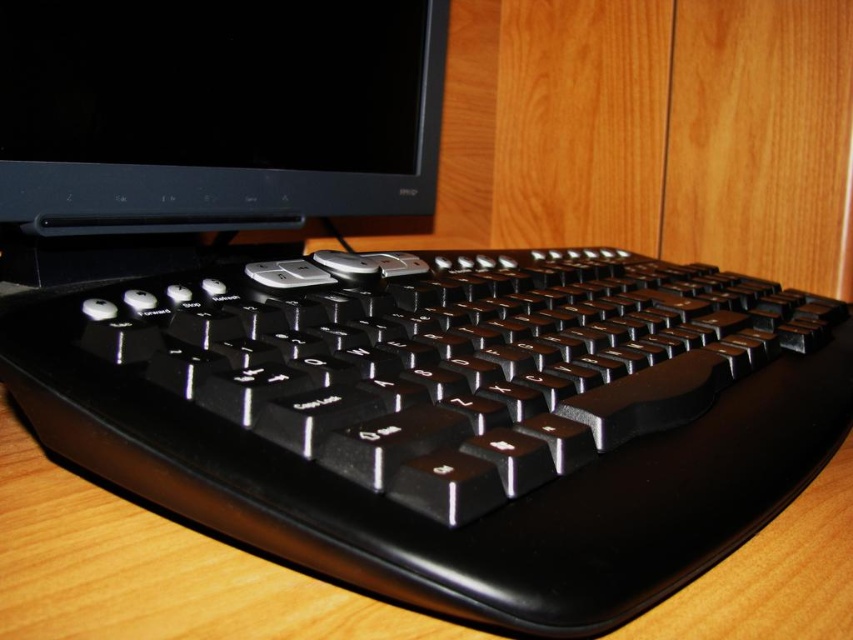
You need to place both the black plastic keyboard at center and the black glossy monitor at upper left onto a desk that can only accommodate one of them. Based on their sizes, which one should you prioritize placing first?

The black plastic keyboard at center is bigger than the black glossy monitor at upper left, so you should prioritize placing the black plastic keyboard at center first to ensure it fits properly.

You are trying to locate the black plastic keyboard at center on a wooden desk. According to the coordinates provided, where exactly is it positioned?

The black plastic keyboard at center is located at the 2D coordinates point (451, 419).

You are setting up a desk for a new computer. You have the black plastic keyboard at center and the black glossy monitor at upper left. Which object is shorter in height?

The black plastic keyboard at center has a lesser height compared to the black glossy monitor at upper left, so the keyboard is shorter in height.